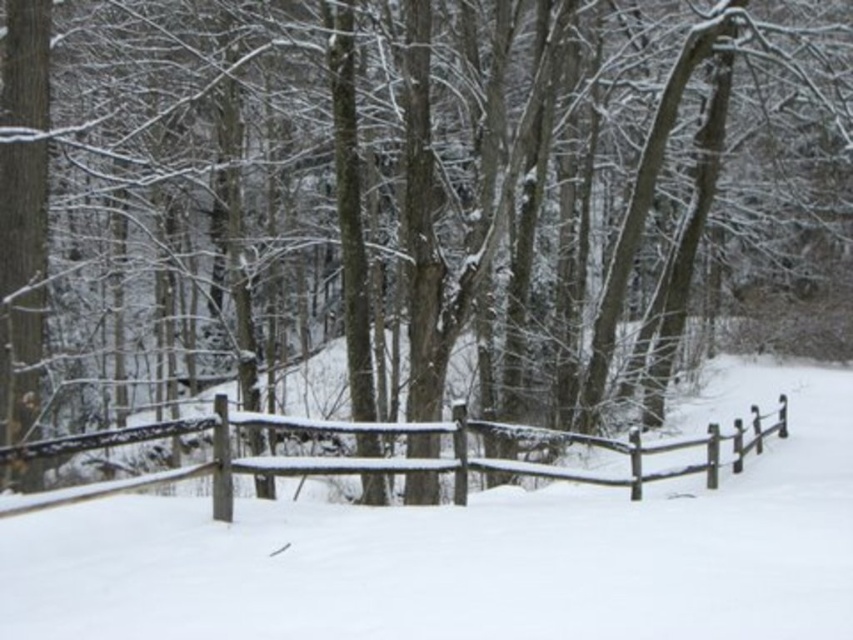
You are a hiker trying to follow the path in the winter forest. You see the white matte snow at center and the wooden fence at center. Which one is taller?

The wooden fence at center is taller than the white matte snow at center.

You are standing at the starting point of the path in the winter forest scene. The wooden fence runs parallel to the path. If you walk straight along the path, will you eventually reach the white matte snow at center?

Yes, because the path winds through the center of the frame where the white matte snow at center is located, so walking straight along the path will lead you to it.

Looking at this image, you are a snowplow operator who needs to clear a path between the white matte snow at center and the wooden fence at center. The snowplow requires a minimum of 4 feet of clearance to operate safely. Based on the scene, will the snowplow be able to navigate this area without getting stuck?

The distance between the white matte snow at center and the wooden fence at center is 4.47 feet, which exceeds the snowplow operator requirement of 4 feet. Therefore, the snowplow can safely navigate the area without getting stuck.